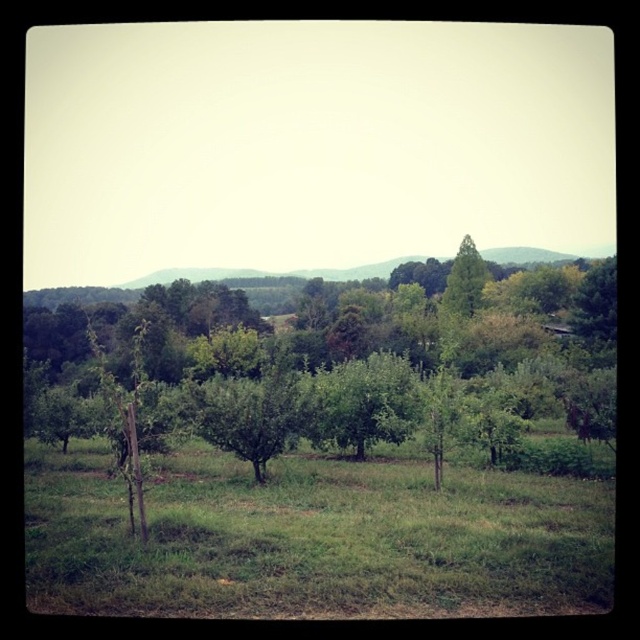
Between green leafy tree at center and green grass at center, which one appears on the left side from the viewer's perspective?

From the viewer's perspective, green leafy tree at center appears more on the left side.

Between green leafy tree at center and green grass at center, which one is positioned higher?

green leafy tree at center is higher up.

This screenshot has height=640, width=640. Describe the element at coordinates (353, 372) in the screenshot. I see `green leafy tree at center` at that location.

Locate an element on the screen. This screenshot has height=640, width=640. green leafy tree at center is located at coordinates (353, 372).